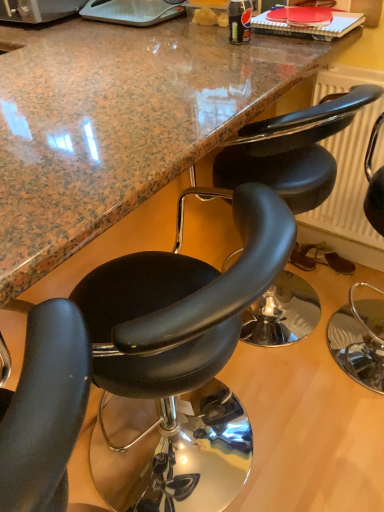
Question: Is marble countertop at center next to black leather chair at right, which appears as the third chair when viewed from the left?

Choices:
 (A) no
 (B) yes

Answer: (A)

Question: Would you consider marble countertop at center to be distant from black leather chair at right, which appears as the third chair when viewed from the left?

Choices:
 (A) no
 (B) yes

Answer: (B)

Question: From a real-world perspective, is marble countertop at center positioned over black leather chair at right, which appears as the third chair when viewed from the left, based on gravity?

Choices:
 (A) yes
 (B) no

Answer: (A)

Question: From a real-world perspective, is marble countertop at center below black leather chair at right, which is the 1th chair in right-to-left order?

Choices:
 (A) yes
 (B) no

Answer: (B)

Question: Could you tell me if marble countertop at center is turned towards black leather chair at right, which is the 1th chair in right-to-left order?

Choices:
 (A) yes
 (B) no

Answer: (B)

Question: Can you confirm if marble countertop at center is thinner than black leather chair at right, which is the 1th chair in right-to-left order?

Choices:
 (A) no
 (B) yes

Answer: (A)

Question: Does black leather chair at right, which is the 1th chair in right-to-left order, appear on the right side of black leather chair at center, the 2th chair viewed from the left?

Choices:
 (A) no
 (B) yes

Answer: (B)

Question: Could you tell me if black leather chair at right, which appears as the third chair when viewed from the left, is turned towards black leather chair at center, the 2th chair viewed from the left?

Choices:
 (A) yes
 (B) no

Answer: (A)

Question: Is black leather chair at right, which appears as the third chair when viewed from the left, positioned with its back to black leather chair at center, the 2th chair in the right-to-left sequence?

Choices:
 (A) yes
 (B) no

Answer: (A)

Question: From the image's perspective, is black leather chair at right, which appears as the third chair when viewed from the left, below black leather chair at center, the 2th chair in the right-to-left sequence?

Choices:
 (A) no
 (B) yes

Answer: (B)

Question: From a real-world perspective, is black leather chair at right, which is the 1th chair in right-to-left order, below black leather chair at center, the 2th chair viewed from the left?

Choices:
 (A) no
 (B) yes

Answer: (A)

Question: Can you confirm if black leather chair at right, which is the 1th chair in right-to-left order, is bigger than black leather chair at center, the 2th chair viewed from the left?

Choices:
 (A) yes
 (B) no

Answer: (B)

Question: From the image's perspective, is marble countertop at center located above black leather chair at center, the 2th chair viewed from the left?

Choices:
 (A) yes
 (B) no

Answer: (A)